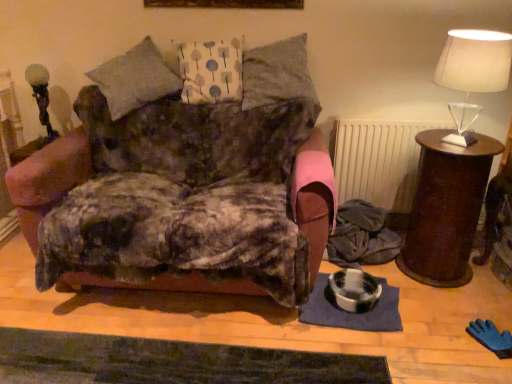
Question: From a real-world perspective, is translucent glass table lamp at upper right, positioned as the 2th table lamp in back-to-front order, physically located above or below white fabric pillow at center, arranged as the second pillow when viewed from the right?

Choices:
 (A) below
 (B) above

Answer: (A)

Question: Is translucent glass table lamp at upper right, which is the first table lamp in right-to-left order, taller or shorter than white fabric pillow at center, arranged as the second pillow when viewed from the right?

Choices:
 (A) short
 (B) tall

Answer: (B)

Question: Which of these objects is positioned farthest from the textured gray pillow at upper center, the 2th pillow when ordered from left to right?

Choices:
 (A) matte glass table lamp at left, the 1th table lamp in the left-to-right sequence
 (B) white fabric pillow at center, marked as the first pillow in a left-to-right arrangement
 (C) brown wooden side table at right
 (D) translucent glass table lamp at upper right, which ranks as the first table lamp in front-to-back order
 (E) velvet floral armchair at center

Answer: (A)

Question: Estimate the real-world distances between objects in this image. Which object is closer to the textured gray pillow at upper center, which is counted as the 1th pillow, starting from the right?

Choices:
 (A) white fabric pillow at center, arranged as the second pillow when viewed from the right
 (B) brown wooden side table at right
 (C) velvet floral armchair at center
 (D) translucent glass table lamp at upper right, which is the 2th table lamp in left-to-right order
 (E) matte glass table lamp at left, which ranks as the 2th table lamp in right-to-left order

Answer: (A)